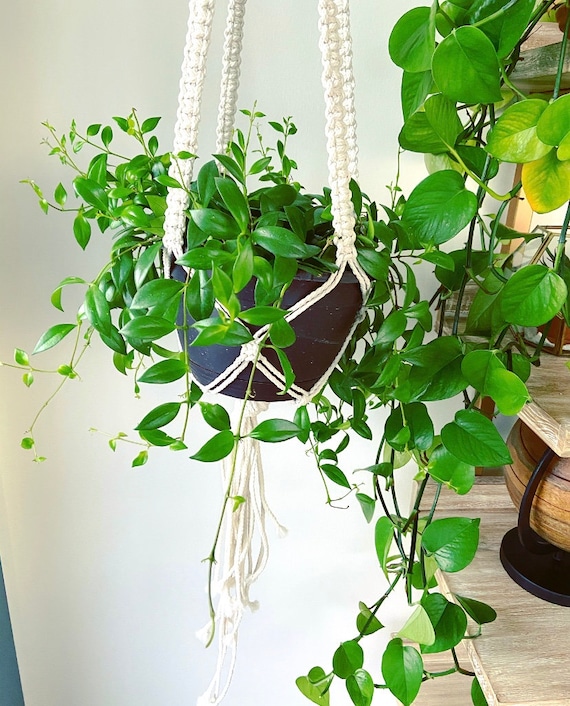
At what (x,y) coordinates should I click in order to perform the action: click on flower pot. Please return your answer as a coordinate pair (x, y). The height and width of the screenshot is (706, 570). Looking at the image, I should click on (564, 18).